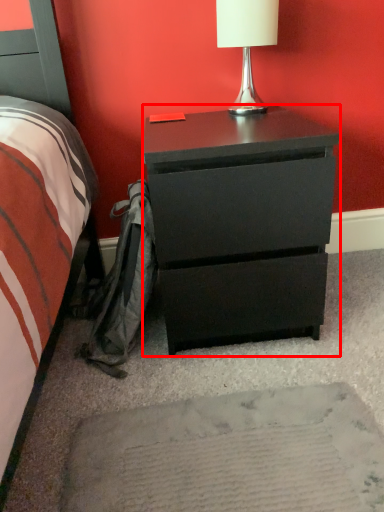
Question: From the image's perspective, where is chest of drawers (annotated by the red box) located relative to table lamp?

Choices:
 (A) below
 (B) above

Answer: (A)